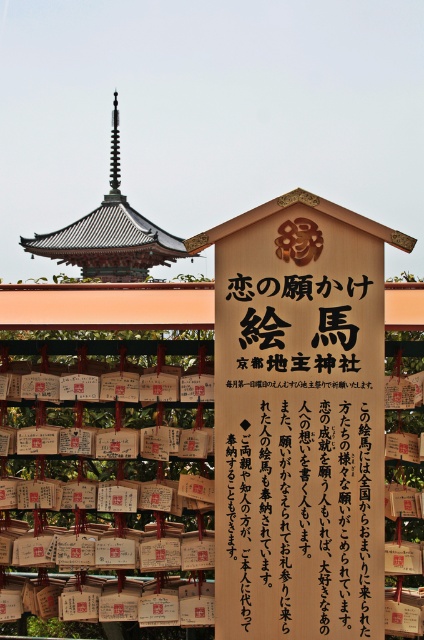
Between wooden sign at center and dark brown wooden pagoda at upper center, which one appears on the left side from the viewer's perspective?

Positioned to the left is dark brown wooden pagoda at upper center.

Can you confirm if wooden sign at center is taller than dark brown wooden pagoda at upper center?

In fact, wooden sign at center may be shorter than dark brown wooden pagoda at upper center.

Is point (373, 289) farther from viewer compared to point (94, 241)?

That is False.

I want to click on wooden sign at center, so click(298, 420).